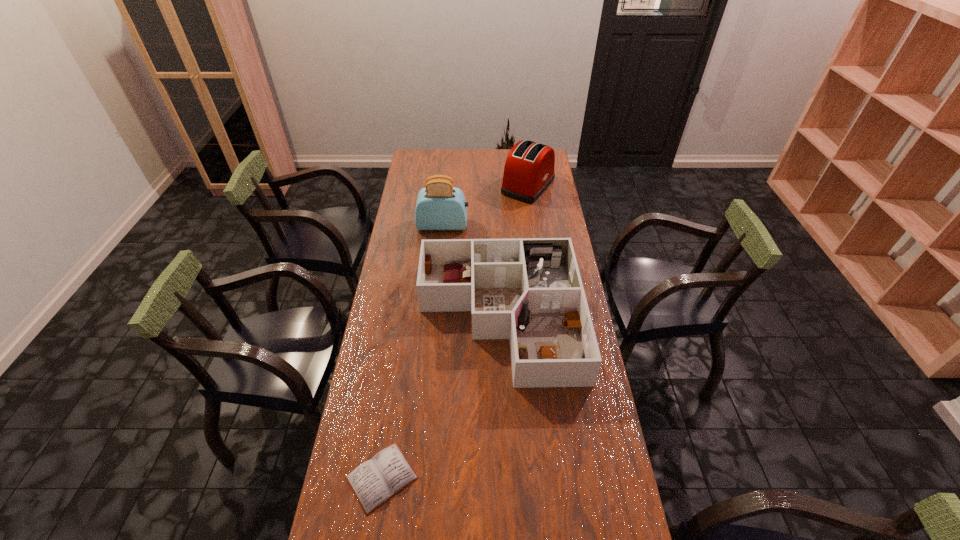
Where is `the left toaster`? The width and height of the screenshot is (960, 540). the left toaster is located at coordinates (440, 206).

In order to click on the third nearest object in this screenshot , I will do `click(440, 206)`.

Identify the location of the farthest object. The height and width of the screenshot is (540, 960). (529, 169).

Locate an element on the screen. The width and height of the screenshot is (960, 540). the farther toaster is located at coordinates (529, 169).

Where is `dollhouse`? This screenshot has height=540, width=960. dollhouse is located at coordinates (529, 290).

Identify the location of the third tallest object. The height and width of the screenshot is (540, 960). (529, 290).

At what (x,y) coordinates should I click in order to perform the action: click on diary. Please return your answer as a coordinate pair (x, y). The height and width of the screenshot is (540, 960). Looking at the image, I should click on [x=375, y=481].

Identify the location of the nearest object. The width and height of the screenshot is (960, 540). (375, 481).

I want to click on vacant space located on the side of the second farthest object with the lever, so click(x=538, y=225).

Where is `vacant region located 0.060m on the front of the farther toaster`? The height and width of the screenshot is (540, 960). vacant region located 0.060m on the front of the farther toaster is located at coordinates (532, 212).